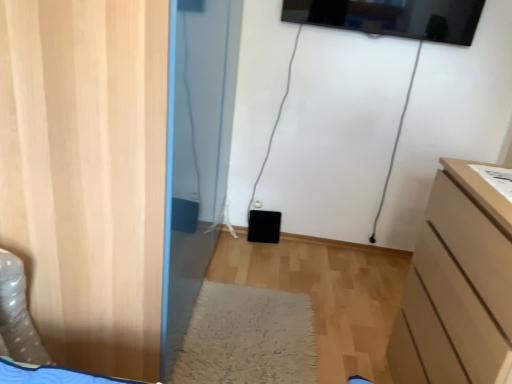
Question: Does wooden door at left come in front of matte beige chest of drawers at right?

Choices:
 (A) yes
 (B) no

Answer: (B)

Question: Considering the relative sizes of wooden door at left and matte beige chest of drawers at right in the image provided, is wooden door at left thinner than matte beige chest of drawers at right?

Choices:
 (A) no
 (B) yes

Answer: (A)

Question: Can you confirm if wooden door at left is smaller than matte beige chest of drawers at right?

Choices:
 (A) no
 (B) yes

Answer: (A)

Question: From a real-world perspective, is wooden door at left on top of matte beige chest of drawers at right?

Choices:
 (A) yes
 (B) no

Answer: (A)

Question: Is wooden door at left facing away from matte beige chest of drawers at right?

Choices:
 (A) yes
 (B) no

Answer: (B)

Question: Considering the relative positions of wooden door at left and matte beige chest of drawers at right in the image provided, is wooden door at left to the right of matte beige chest of drawers at right from the viewer's perspective?

Choices:
 (A) yes
 (B) no

Answer: (B)

Question: Is wooden door at left positioned with its back to white shaggy rug at center?

Choices:
 (A) no
 (B) yes

Answer: (A)

Question: From a real-world perspective, does wooden door at left sit lower than white shaggy rug at center?

Choices:
 (A) yes
 (B) no

Answer: (B)

Question: From a real-world perspective, is wooden door at left over white shaggy rug at center?

Choices:
 (A) yes
 (B) no

Answer: (A)

Question: Is wooden door at left positioned far away from white shaggy rug at center?

Choices:
 (A) yes
 (B) no

Answer: (B)

Question: Is wooden door at left smaller than white shaggy rug at center?

Choices:
 (A) no
 (B) yes

Answer: (A)

Question: From the image's perspective, is wooden door at left above white shaggy rug at center?

Choices:
 (A) no
 (B) yes

Answer: (B)

Question: Considering the relative positions of white shaggy rug at center and wooden door at left in the image provided, is white shaggy rug at center behind wooden door at left?

Choices:
 (A) no
 (B) yes

Answer: (B)